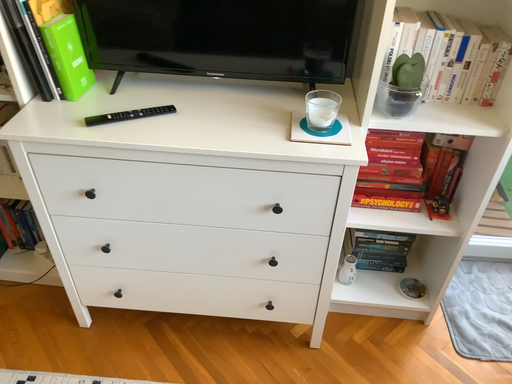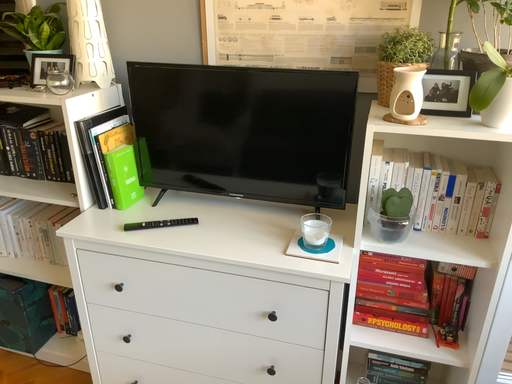
Question: How did the camera likely rotate when shooting the video?

Choices:
 (A) rotated upward
 (B) rotated downward

Answer: (A)